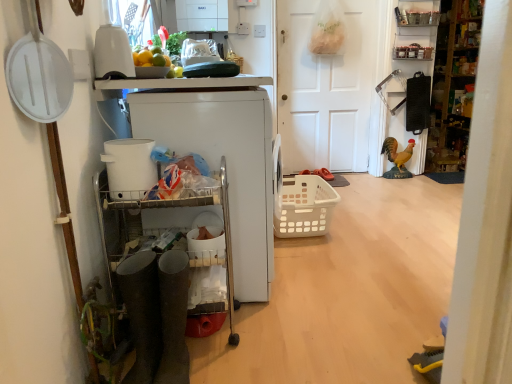
This screenshot has height=384, width=512. In order to click on vacant space to the right of white plastic cart at left, the 1th appliance viewed from the back in this screenshot , I will do `click(385, 226)`.